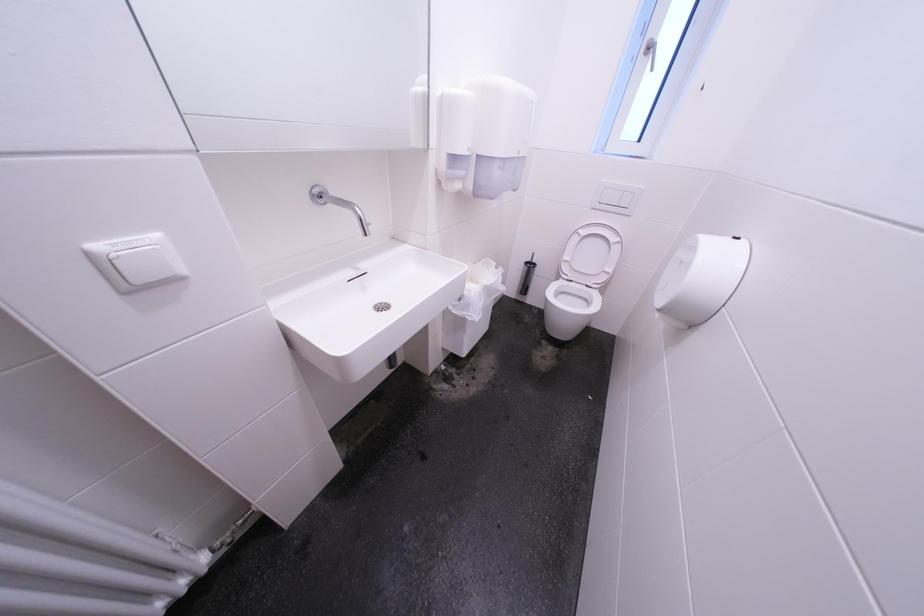
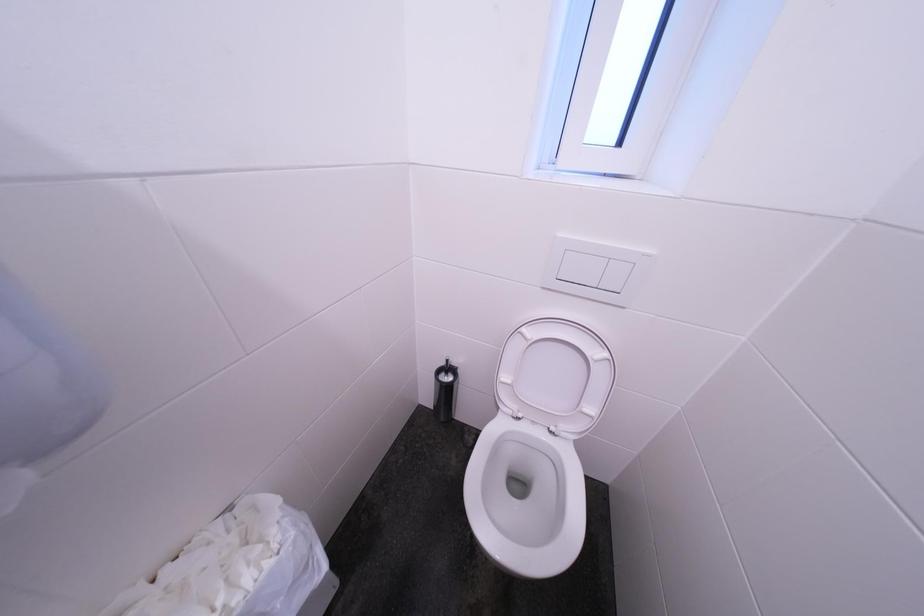
In a continuous first-person perspective shot, in which direction is the camera moving?

The cameraman moved toward right, forward.